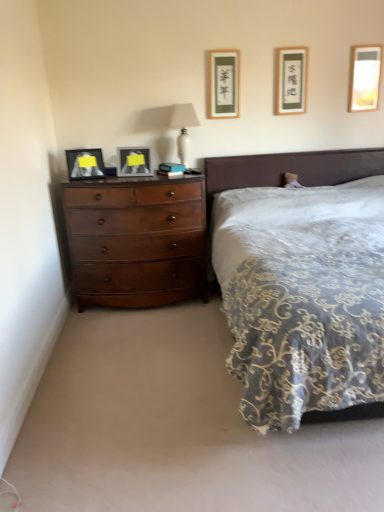
Question: From their relative heights in the image, would you say matte black picture frame at upper center, the 2th picture frame in the right-to-left sequence, is taller or shorter than matte gold picture frame at upper center, which is the third picture frame from right to left?

Choices:
 (A) tall
 (B) short

Answer: (B)

Question: Is matte black picture frame at upper center, the 4th picture frame positioned from the left, inside the boundaries of matte gold picture frame at upper center, the 3th picture frame viewed from the left, or outside?

Choices:
 (A) outside
 (B) inside

Answer: (A)

Question: Considering the real-world distances, which object is closest to the shiny brown dresser at left?

Choices:
 (A) matte black picture frame at left, which ranks as the fifth picture frame in right-to-left order
 (B) velvet-like brown bed at center
 (C) matte glass picture frame at left, positioned as the fourth picture frame in right-to-left order
 (D) matte black picture frame at upper center, the 2th picture frame in the right-to-left sequence
 (E) matte gold picture frame at upper center, the 3th picture frame viewed from the left

Answer: (C)

Question: Which object is positioned farthest from the shiny brown dresser at left?

Choices:
 (A) velvet-like brown bed at center
 (B) matte black picture frame at left, which ranks as the fifth picture frame in right-to-left order
 (C) white glossy lamp at upper center
 (D) matte glass picture frame at left, positioned as the fourth picture frame in right-to-left order
 (E) matte gold picture frame at upper center, which is the third picture frame from right to left

Answer: (E)